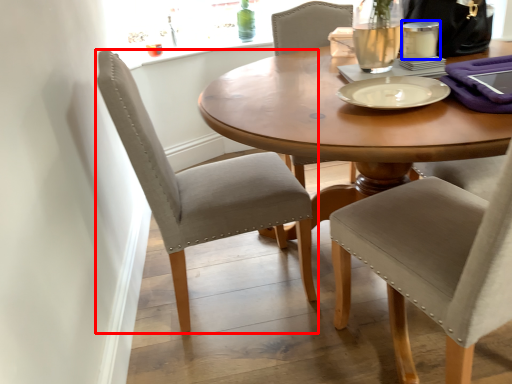
Question: Among these objects, which one is nearest to the camera, chair (highlighted by a red box) or tableware (highlighted by a blue box)?

Choices:
 (A) chair
 (B) tableware

Answer: (A)